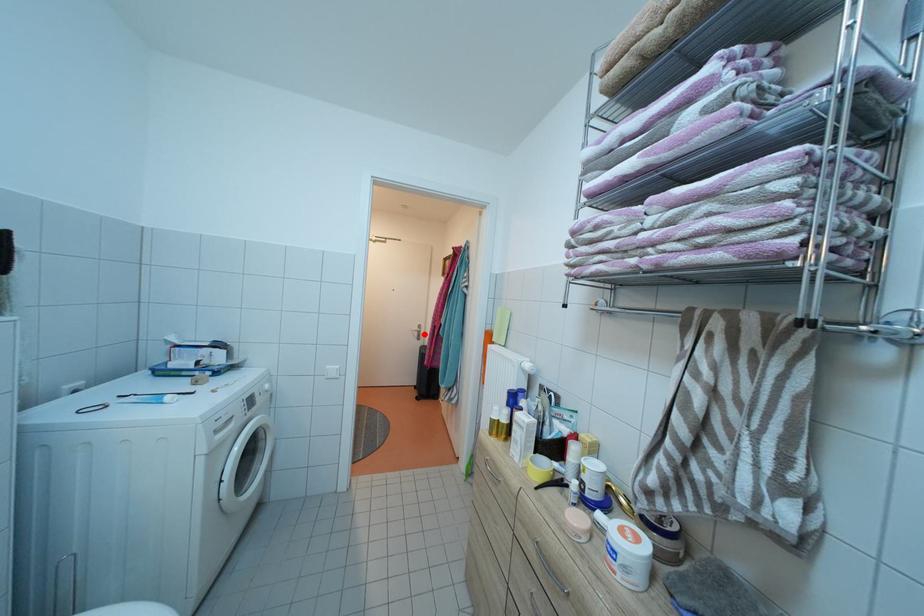
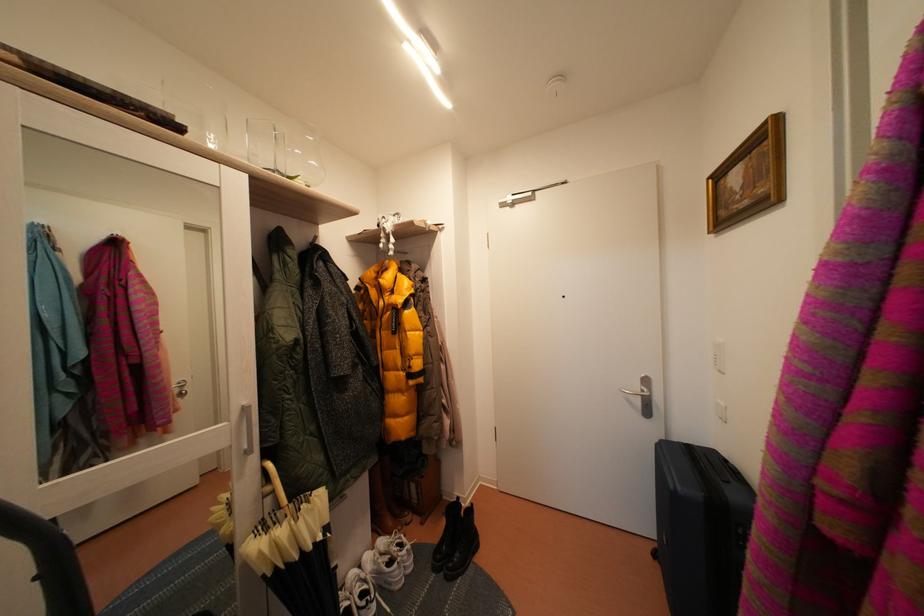
Question: I am providing you with two images of the same scene from different viewpoints. Image1 has a red point marked. In image2, the corresponding 3D location appears at what relative position? Reply with the corresponding letter.

Choices:
 (A) Closer
 (B) Farther

Answer: (A)